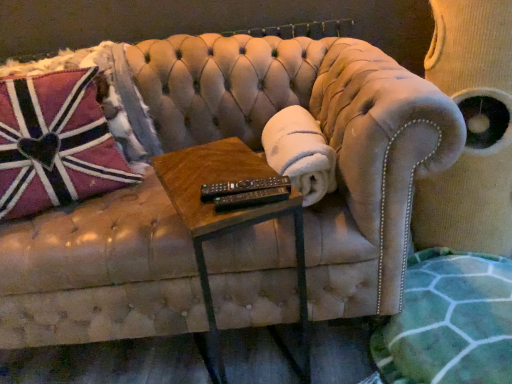
Question: Is woodenmaterial/texturetable at center further to camera compared to velvet swivel chair at upper right?

Choices:
 (A) yes
 (B) no

Answer: (B)

Question: From the image's perspective, is woodenmaterial/texturetable at center under velvet swivel chair at upper right?

Choices:
 (A) yes
 (B) no

Answer: (A)

Question: From a real-world perspective, is woodenmaterial/texturetable at center positioned over velvet swivel chair at upper right based on gravity?

Choices:
 (A) yes
 (B) no

Answer: (B)

Question: Does woodenmaterial/texturetable at center have a greater width compared to velvet swivel chair at upper right?

Choices:
 (A) no
 (B) yes

Answer: (B)

Question: Are woodenmaterial/texturetable at center and velvet swivel chair at upper right located far from each other?

Choices:
 (A) yes
 (B) no

Answer: (B)

Question: Does woodenmaterial/texturetable at center appear on the left side of velvet swivel chair at upper right?

Choices:
 (A) yes
 (B) no

Answer: (A)

Question: From the image's perspective, is pink plush pillow at left located above black plastic remote at center?

Choices:
 (A) yes
 (B) no

Answer: (A)

Question: Is pink plush pillow at left not near black plastic remote at center?

Choices:
 (A) no
 (B) yes

Answer: (A)

Question: Does pink plush pillow at left have a greater height compared to black plastic remote at center?

Choices:
 (A) yes
 (B) no

Answer: (A)

Question: From a real-world perspective, is pink plush pillow at left over black plastic remote at center?

Choices:
 (A) yes
 (B) no

Answer: (B)

Question: Is pink plush pillow at left oriented towards black plastic remote at center?

Choices:
 (A) yes
 (B) no

Answer: (B)

Question: Is pink plush pillow at left in contact with black plastic remote at center?

Choices:
 (A) no
 (B) yes

Answer: (A)

Question: Considering the relative sizes of white fluffy blanket at center and green textured blanket at lower right in the image provided, is white fluffy blanket at center bigger than green textured blanket at lower right?

Choices:
 (A) yes
 (B) no

Answer: (B)